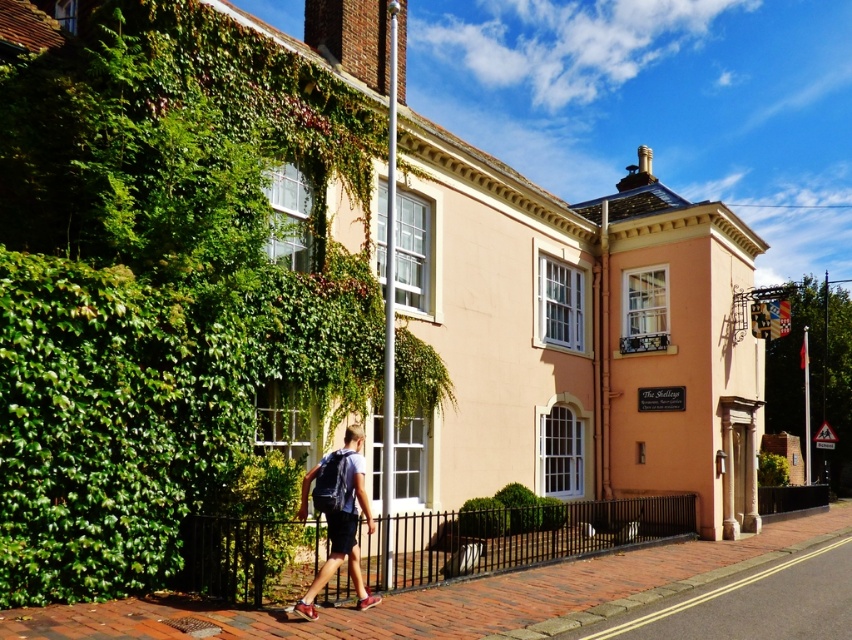
You are standing at the point labeled point (453, 595). What type of surface are you currently standing on?

You are standing on brick pavement at lower center.

You are standing on the sidewalk and see the green ivy hedge at left and the denim shorts at lower left. Which object is closer to you?

The denim shorts at lower left is behind the green ivy hedge at left, so the green ivy hedge at left is closer to you.